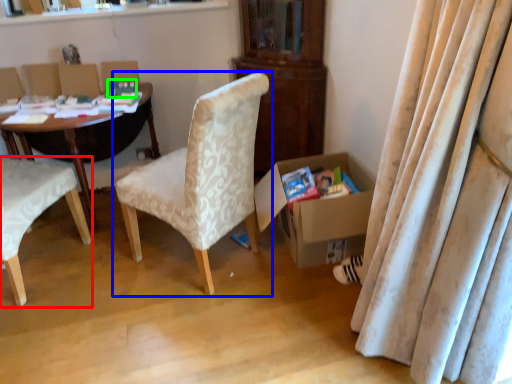
Question: Based on their relative distances, which object is nearer to chair (highlighted by a red box)? Choose from chair (highlighted by a blue box) and paperback book (highlighted by a green box).

Choices:
 (A) chair
 (B) paperback book

Answer: (A)